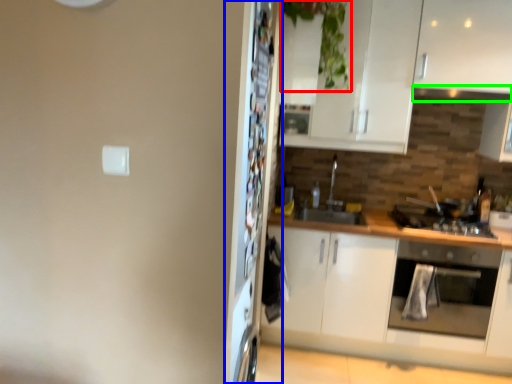
Question: Based on their relative distances, which object is farther from plant (highlighted by a red box)? Choose from fridge (highlighted by a blue box) and exhaust hood (highlighted by a green box).

Choices:
 (A) fridge
 (B) exhaust hood

Answer: (A)